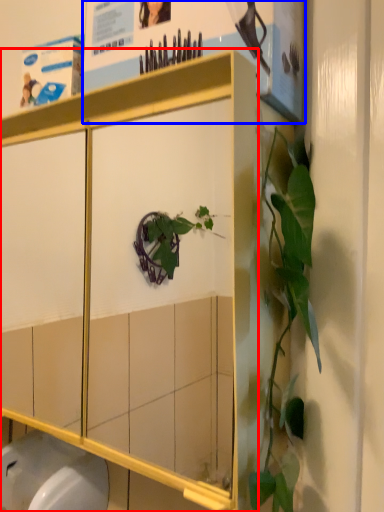
Question: Which object is further to the camera taking this photo, cabinetry (highlighted by a red box) or poster page (highlighted by a blue box)?

Choices:
 (A) cabinetry
 (B) poster page

Answer: (B)